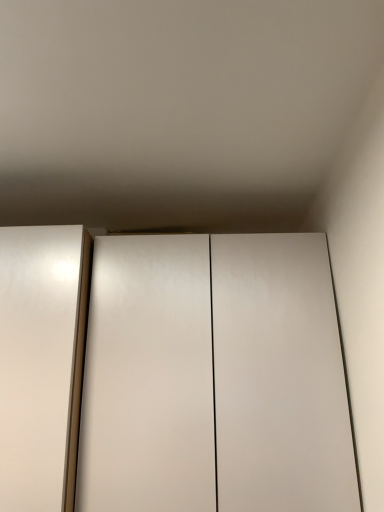
Describe the element at coordinates (41, 362) in the screenshot. The height and width of the screenshot is (512, 384). I see `white glossy elevator at left` at that location.

Where is `white glossy elevator at left`? This screenshot has height=512, width=384. white glossy elevator at left is located at coordinates (41, 362).

At what (x,y) coordinates should I click in order to perform the action: click on white glossy cupboard at center. Please return your answer as a coordinate pair (x, y). The height and width of the screenshot is (512, 384). Looking at the image, I should click on coord(172,374).

Describe the element at coordinates (172, 374) in the screenshot. I see `white glossy cupboard at center` at that location.

Where is `white glossy elevator at left`? This screenshot has height=512, width=384. white glossy elevator at left is located at coordinates (41, 362).

Based on their positions, is white glossy elevator at left located to the left or right of white glossy cupboard at center?

white glossy elevator at left is positioned on white glossy cupboard at center's left side.

Considering their positions, is white glossy elevator at left located in front of or behind white glossy cupboard at center?

Visually, white glossy elevator at left is located in front of white glossy cupboard at center.

Does point (83, 230) come closer to viewer compared to point (119, 390)?

No.

Looking at this image, from the image's perspective, which one is positioned higher, white glossy elevator at left or white glossy cupboard at center?

white glossy elevator at left, from the image's perspective.

From a real-world perspective, relative to white glossy cupboard at center, is white glossy elevator at left vertically above or below?

From a real-world perspective, white glossy elevator at left is physically above white glossy cupboard at center.

Considering the relative sizes of white glossy elevator at left and white glossy cupboard at center in the image provided, is white glossy elevator at left wider than white glossy cupboard at center?

No.

Which of these two, white glossy elevator at left or white glossy cupboard at center, stands shorter?

Standing shorter between the two is white glossy elevator at left.

Considering the relative sizes of white glossy elevator at left and white glossy cupboard at center in the image provided, is white glossy elevator at left smaller than white glossy cupboard at center?

Indeed, white glossy elevator at left has a smaller size compared to white glossy cupboard at center.

From the picture: Is white glossy elevator at left positioned beyond the bounds of white glossy cupboard at center?

Yes, white glossy elevator at left is located beyond the bounds of white glossy cupboard at center.

Is white glossy elevator at left far away from white glossy cupboard at center?

No, white glossy elevator at left is not far from white glossy cupboard at center.

Is white glossy elevator at left oriented towards white glossy cupboard at center?

No, white glossy elevator at left is not facing towards white glossy cupboard at center.

You are a GUI agent. You are given a task and a screenshot of the screen. Output one action in this format:
    pyautogui.click(x=<x>, y=<y>)
    Task: Click on the elevator in front of the white glossy cupboard at center
    The height and width of the screenshot is (512, 384).
    Given the screenshot: What is the action you would take?
    pyautogui.click(x=41, y=362)

Which object is positioned more to the right, white glossy cupboard at center or white glossy elevator at left?

white glossy cupboard at center.

Is white glossy cupboard at center behind white glossy elevator at left?

Yes, white glossy cupboard at center is behind white glossy elevator at left.

Is point (296, 278) closer to viewer compared to point (7, 413)?

No.

From the image's perspective, is white glossy cupboard at center under white glossy elevator at left?

Yes.

From a real-world perspective, does white glossy cupboard at center stand above white glossy elevator at left?

No.

Considering the sizes of objects white glossy cupboard at center and white glossy elevator at left in the image provided, who is wider, white glossy cupboard at center or white glossy elevator at left?

white glossy cupboard at center is wider.

Is white glossy cupboard at center taller or shorter than white glossy elevator at left?

In the image, white glossy cupboard at center appears to be taller than white glossy elevator at left.

In terms of size, does white glossy cupboard at center appear bigger or smaller than white glossy elevator at left?

Clearly, white glossy cupboard at center is larger in size than white glossy elevator at left.

Would you say white glossy cupboard at center contains white glossy elevator at left?

No, white glossy elevator at left is not surrounded by white glossy cupboard at center.

In the scene shown: Is white glossy cupboard at center touching white glossy elevator at left?

white glossy cupboard at center is not next to white glossy elevator at left, and they're not touching.

Is white glossy cupboard at center looking in the opposite direction of white glossy elevator at left?

No, white glossy cupboard at center's orientation is not away from white glossy elevator at left.

How different are the orientations of white glossy cupboard at center and white glossy elevator at left in degrees?

The angular difference between white glossy cupboard at center and white glossy elevator at left is 0.000347 degrees.

This screenshot has width=384, height=512. In order to click on elevator that appears above the white glossy cupboard at center (from a real-world perspective) in this screenshot , I will do `click(41, 362)`.

The height and width of the screenshot is (512, 384). I want to click on elevator that appears above the white glossy cupboard at center (from a real-world perspective), so click(41, 362).

Locate an element on the screen. The width and height of the screenshot is (384, 512). elevator above the white glossy cupboard at center (from the image's perspective) is located at coordinates (41, 362).